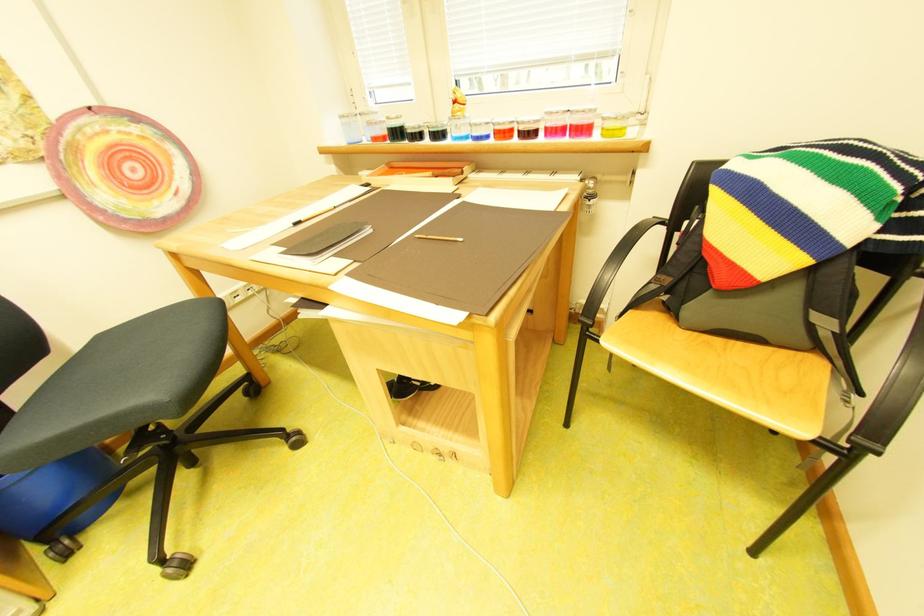
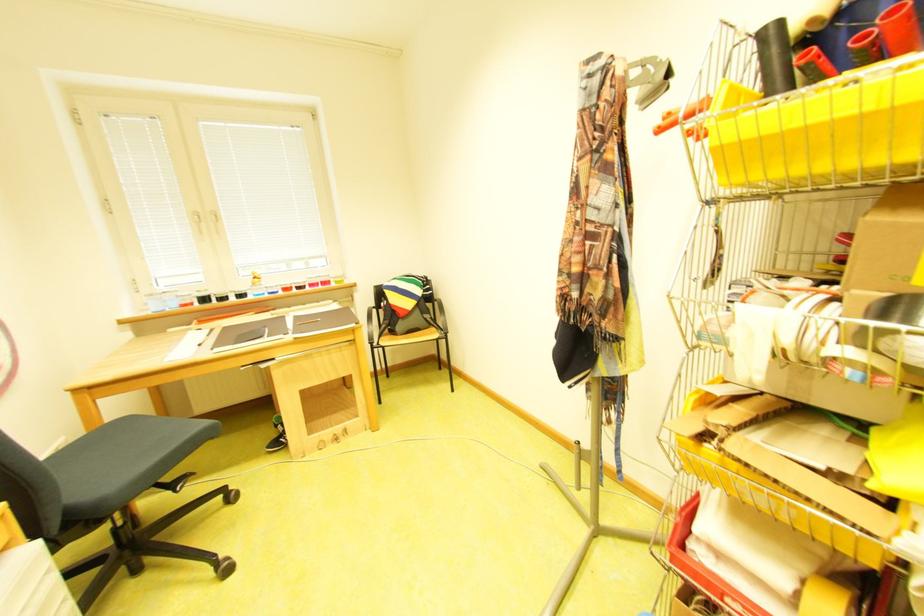
The point at (550,123) is marked in the first image. Where is the corresponding point in the second image?

(315, 283)